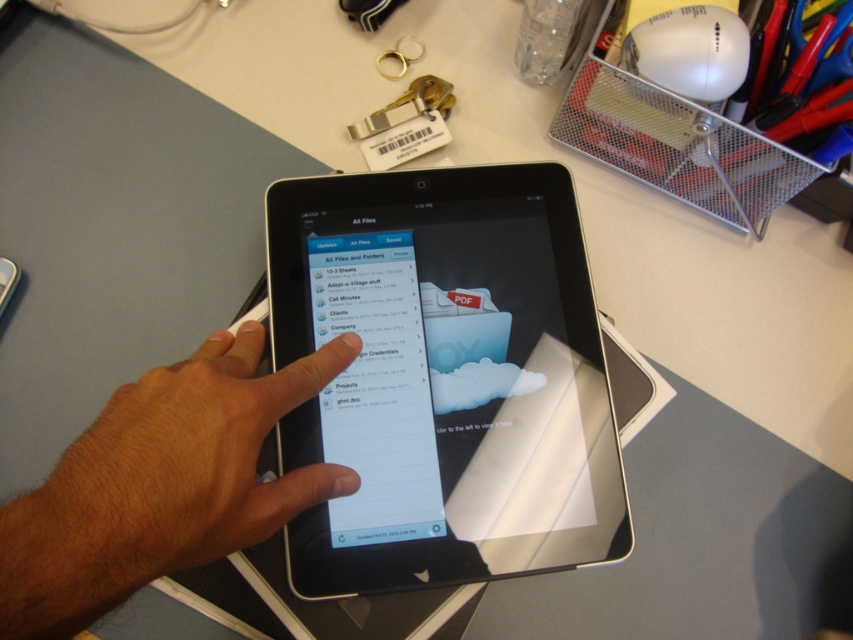
Question: Which of the following is the closest to the observer?

Choices:
 (A) (155, 461)
 (B) (335, 500)

Answer: (A)

Question: Which of the following is the farthest from the observer?

Choices:
 (A) black glossy tablet at center
 (B) brown skin/hair at upper center

Answer: (A)

Question: Is black glossy tablet at center smaller than brown skin/hair at upper center?

Choices:
 (A) no
 (B) yes

Answer: (A)

Question: From the image, what is the correct spatial relationship of black glossy tablet at center in relation to brown skin/hair at upper center?

Choices:
 (A) right
 (B) left

Answer: (A)

Question: Is black glossy tablet at center above brown skin/hair at upper center?

Choices:
 (A) yes
 (B) no

Answer: (A)